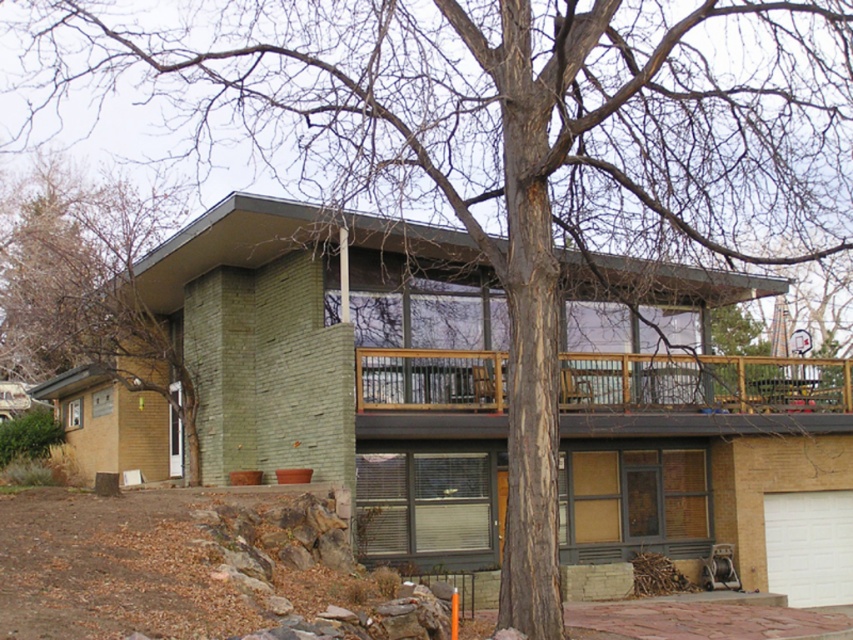
Between point (12, 310) and point (368, 403), which one is positioned in front?

Point (368, 403) is in front.

Consider the image. Who is higher up, green textured wall at left or wooden deck at upper center?

green textured wall at left

This screenshot has height=640, width=853. What do you see at coordinates (84, 284) in the screenshot?
I see `green textured wall at left` at bounding box center [84, 284].

The height and width of the screenshot is (640, 853). Find the location of `green textured wall at left`. green textured wall at left is located at coordinates (84, 284).